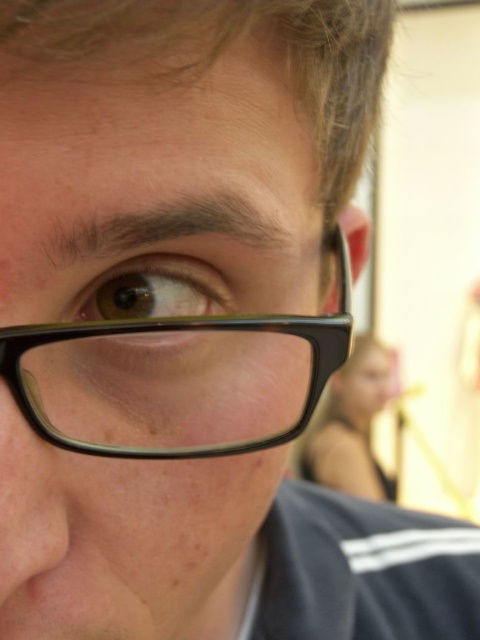
Which is more to the left, black matte glasses at center or brown matte eye at center?

From the viewer's perspective, brown matte eye at center appears more on the left side.

Image resolution: width=480 pixels, height=640 pixels. Describe the element at coordinates (156, 189) in the screenshot. I see `black matte glasses at center` at that location.

Locate an element on the screen. This screenshot has width=480, height=640. black matte glasses at center is located at coordinates (156, 189).

From the picture: Who is positioned more to the left, black plastic glasses at center or brown matte eye at center?

From the viewer's perspective, brown matte eye at center appears more on the left side.

Who is more distant from viewer, (215, 365) or (120, 342)?

The point (215, 365) is behind.

Is point (50, 408) closer to viewer compared to point (182, 273)?

Yes, point (50, 408) is closer to viewer.

Where is `black plastic glasses at center`? The height and width of the screenshot is (640, 480). black plastic glasses at center is located at coordinates (177, 378).

Who is higher up, black matte glasses at center or black plastic glasses at center?

black plastic glasses at center is above.

This screenshot has height=640, width=480. What are the coordinates of `black matte glasses at center` in the screenshot? It's located at (156, 189).

Between point (79, 232) and point (129, 429), which one is positioned in front?

Point (79, 232) is more forward.

You are a GUI agent. You are given a task and a screenshot of the screen. Output one action in this format:
    pyautogui.click(x=<x>, y=<y>)
    Task: Click on the black matte glasses at center
    Image resolution: width=480 pixels, height=640 pixels.
    Given the screenshot: What is the action you would take?
    [156, 189]